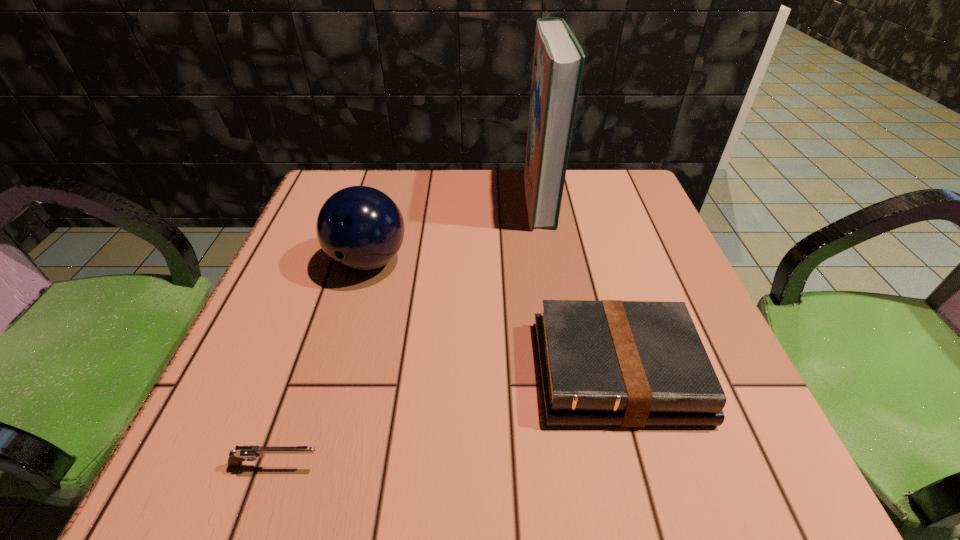
You are a GUI agent. You are given a task and a screenshot of the screen. Output one action in this format:
    pyautogui.click(x=<x>, y=<y>)
    Task: Click on the object present at the near left corner
    The width and height of the screenshot is (960, 540).
    Given the screenshot: What is the action you would take?
    pyautogui.click(x=246, y=452)

Where is `object situated at the near right corner`? object situated at the near right corner is located at coordinates (620, 363).

The image size is (960, 540). In order to click on vacant region at the far edge in this screenshot , I will do `click(425, 187)`.

At what (x,y) coordinates should I click in order to perform the action: click on free spot at the near edge of the desktop. Please return your answer as a coordinate pair (x, y). Looking at the image, I should click on (532, 428).

Locate an element on the screen. This screenshot has height=540, width=960. vacant space at the left edge of the desktop is located at coordinates (287, 325).

Locate an element on the screen. The height and width of the screenshot is (540, 960). free spot at the right edge of the desktop is located at coordinates (602, 266).

Identify the location of free space at the far left corner of the desktop. The height and width of the screenshot is (540, 960). (372, 174).

Identify the location of vacant space at the near left corner. The width and height of the screenshot is (960, 540). (258, 461).

This screenshot has height=540, width=960. I want to click on vacant space at the far right corner of the desktop, so click(583, 214).

Find the location of a particular element. The width and height of the screenshot is (960, 540). vacant area that lies between the second shortest object and the pistol is located at coordinates (446, 418).